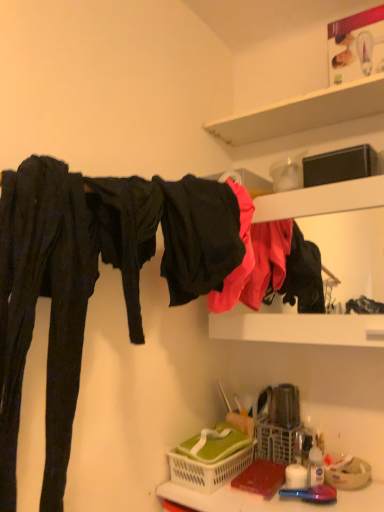
Question: Which is correct: matte black clothing at upper right is inside translucent plastic basket at lower center, or outside of it?

Choices:
 (A) inside
 (B) outside

Answer: (B)

Question: From a real-world perspective, is matte black clothing at upper right physically located above or below translucent plastic basket at lower center?

Choices:
 (A) above
 (B) below

Answer: (A)

Question: Which is farther from the matte black clothing at upper right?

Choices:
 (A) green plastic basket at lower center, positioned as the 1th basket in left-to-right order
 (B) translucent plastic bottle at lower right
 (C) white matte shelf at upper center
 (D) translucent plastic basket at lower center
 (E) white plastic basket at lower center, the second basket when ordered from left to right

Answer: (C)

Question: Estimate the real-world distances between objects in this image. Which object is farther from the green plastic basket at lower center, positioned as the 1th basket in left-to-right order?

Choices:
 (A) translucent plastic basket at lower center
 (B) black matte fabric at upper center
 (C) matte black clothing at upper right
 (D) translucent plastic bottle at lower right
 (E) white plastic basket at lower center, the second basket when ordered from left to right

Answer: (B)